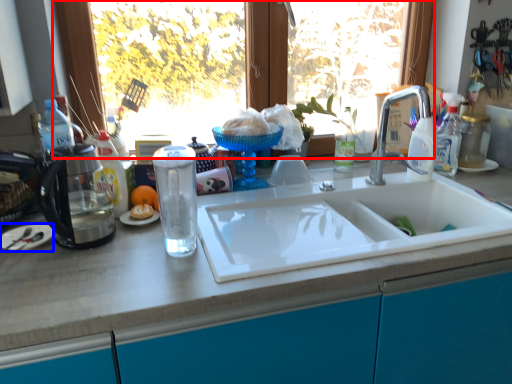
Question: Which of the following is the closest to the observer, window (highlighted by a red box) or plate (highlighted by a blue box)?

Choices:
 (A) window
 (B) plate

Answer: (B)